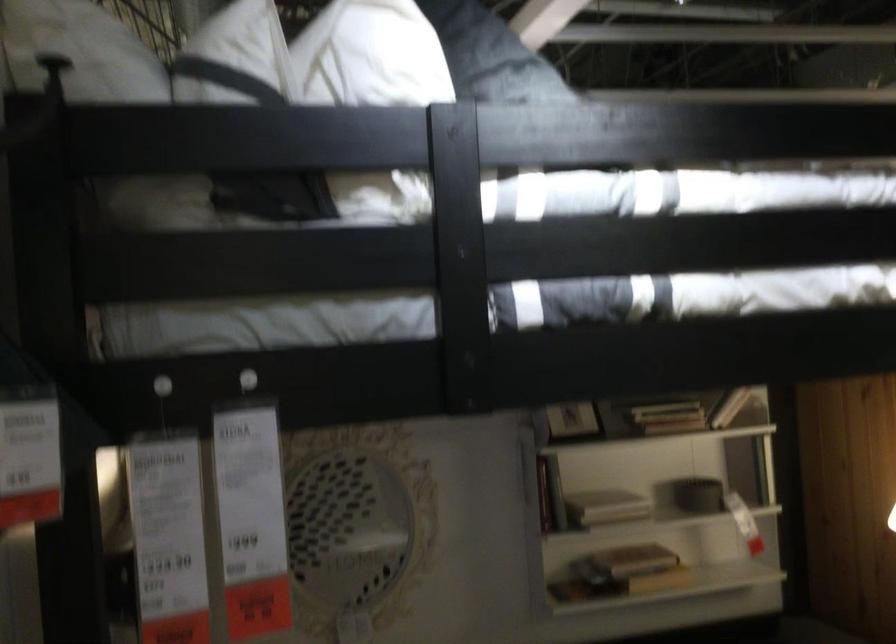
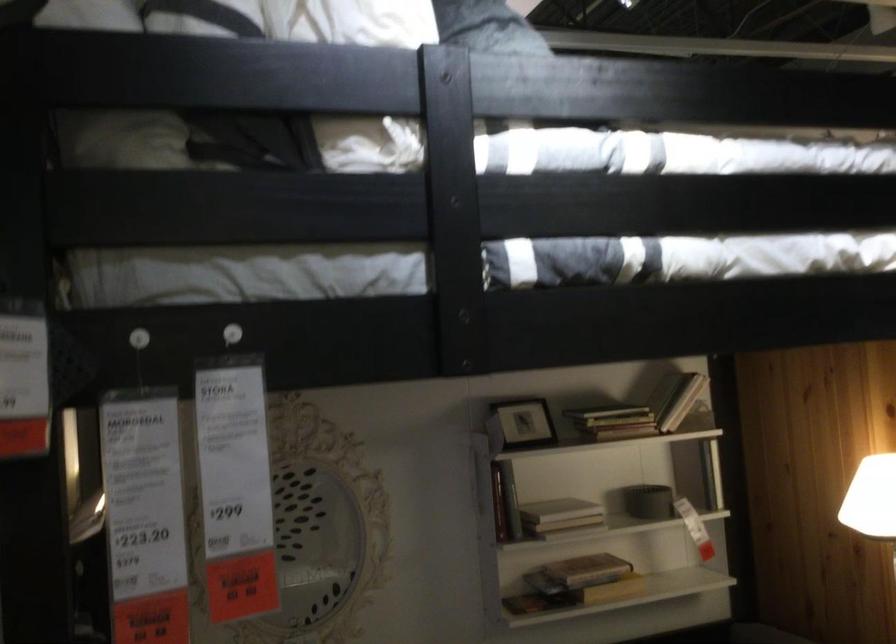
The point at (x=159, y=386) is marked in the first image. Where is the corresponding point in the second image?

(139, 337)